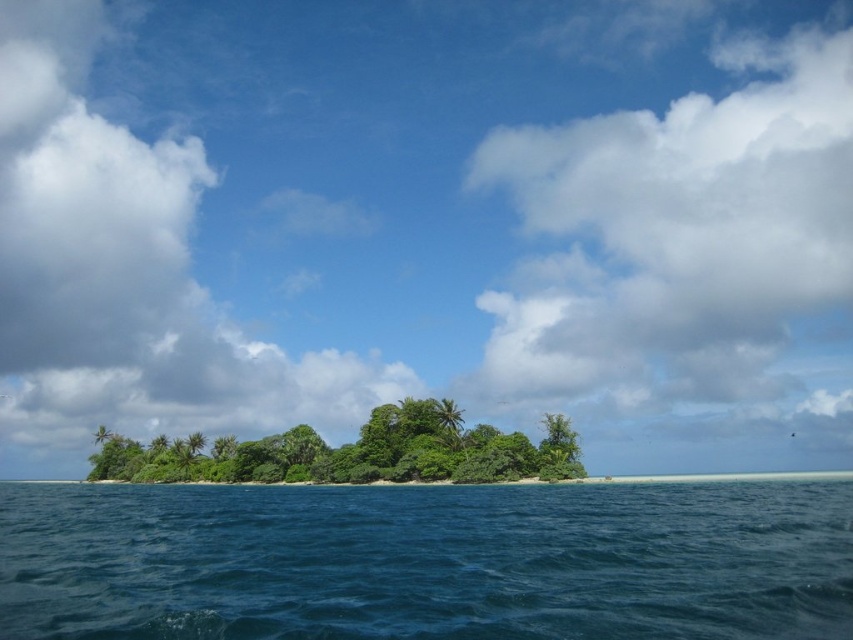
Looking at this image, you are a bird soaring above the tropical island scene. You notice the deep blue water at center and the green leafy trees at center. Which one appears closer to the horizon?

The deep blue water at center appears closer to the horizon than the green leafy trees at center because it is shorter in height.